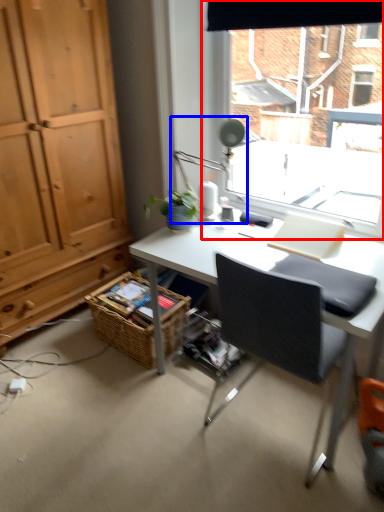
Question: Among these objects, which one is nearest to the camera, window (highlighted by a red box) or table lamp (highlighted by a blue box)?

Choices:
 (A) window
 (B) table lamp

Answer: (A)